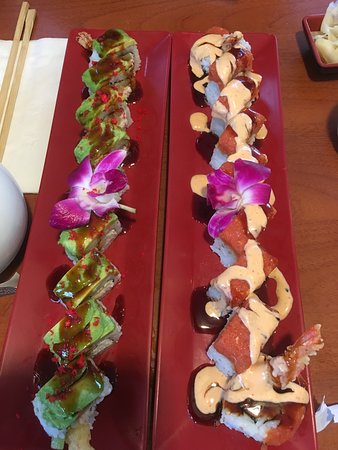
This screenshot has width=338, height=450. In order to click on left tray in this screenshot , I will do `click(145, 233)`.